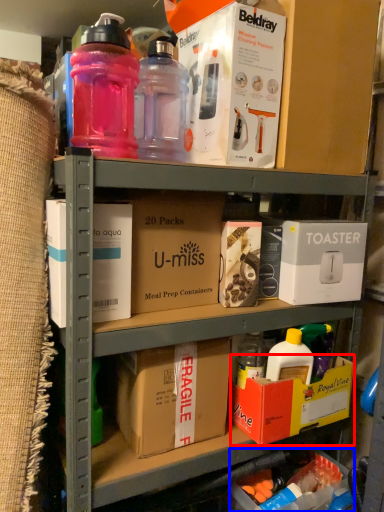
Question: Among these objects, which one is nearest to the camera, box (highlighted by a red box) or box (highlighted by a blue box)?

Choices:
 (A) box
 (B) box

Answer: (A)